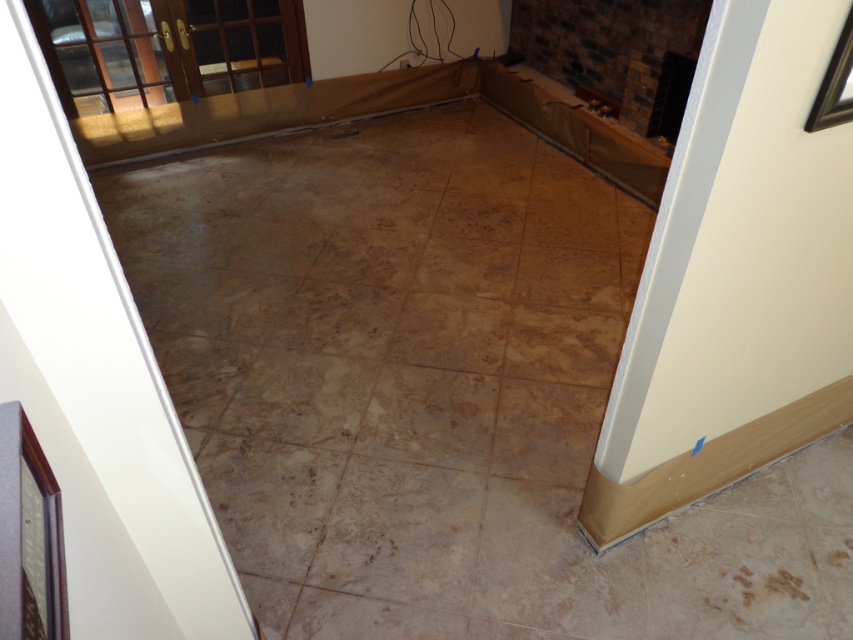
What do you see at coordinates (735, 276) in the screenshot? I see `white painted wood baseboard at lower right` at bounding box center [735, 276].

Who is more distant from viewer, (762, 113) or (415, 550)?

The point (415, 550) is more distant.

Measure the distance between white painted wood baseboard at lower right and camera.

A distance of 1.04 meters exists between white painted wood baseboard at lower right and camera.

I want to click on white painted wood baseboard at lower right, so click(735, 276).